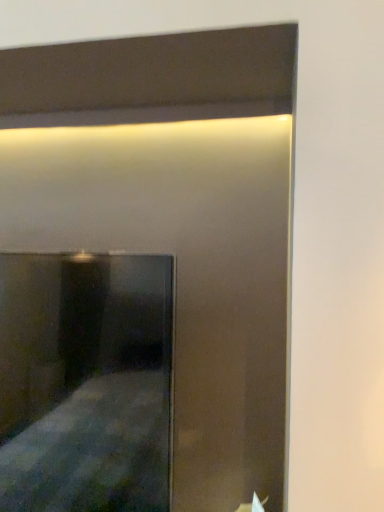
What is the approximate height of metallic mirror at center?

metallic mirror at center is 20.14 inches tall.

The height and width of the screenshot is (512, 384). Describe the element at coordinates (85, 382) in the screenshot. I see `metallic mirror at center` at that location.

Locate an element on the screen. Image resolution: width=384 pixels, height=512 pixels. metallic mirror at center is located at coordinates (85, 382).

Where is `metallic mirror at center`? Image resolution: width=384 pixels, height=512 pixels. metallic mirror at center is located at coordinates (85, 382).